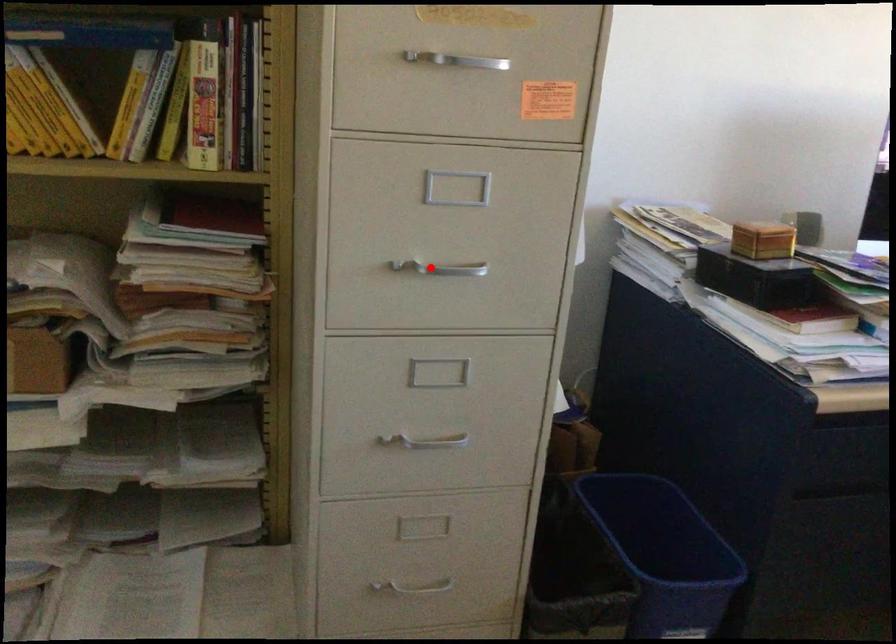
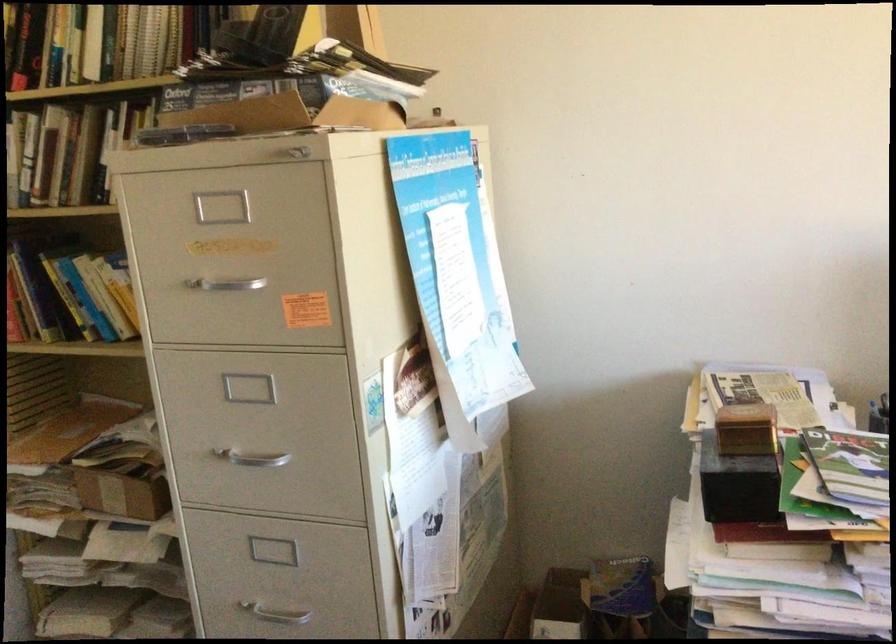
Question: I am providing you with two images of the same scene from different viewpoints. Given a red point in image1, look at the same physical point in image2. Is it:

Choices:
 (A) Closer to the viewpoint
 (B) Farther from the viewpoint

Answer: (B)